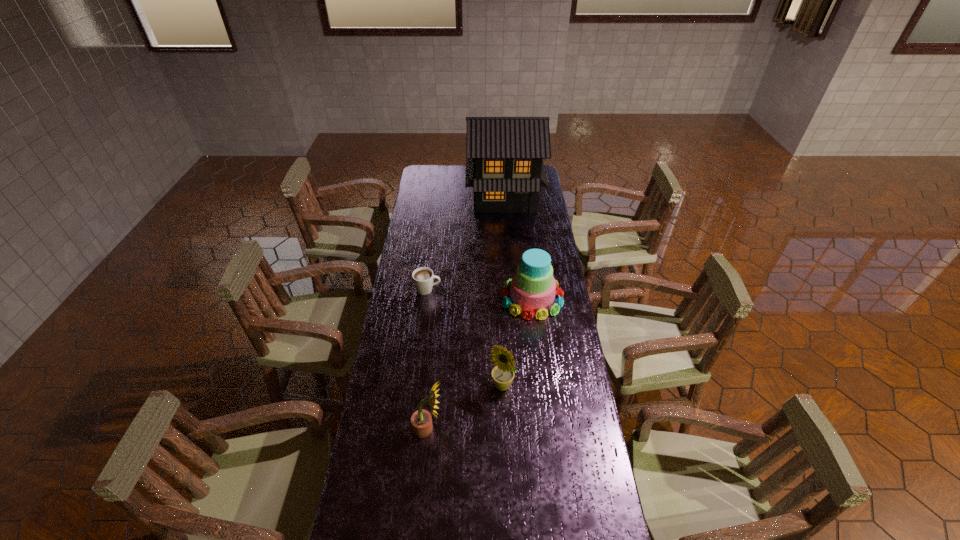
The image size is (960, 540). What are the coordinates of `vacant area situated 0.120m on the face of the nearest object` in the screenshot? It's located at (479, 428).

What are the coordinates of `blank space located on the face of the right sunflower` in the screenshot? It's located at (507, 519).

Locate an element on the screen. free region located with the handle on the side of the shortest object is located at coordinates (488, 289).

Find the location of a particular element. This screenshot has width=960, height=540. object situated at the far edge is located at coordinates (504, 155).

You are a GUI agent. You are given a task and a screenshot of the screen. Output one action in this format:
    pyautogui.click(x=<x>, y=<y>)
    Task: Click on the sunflower positioned at the left edge
    This screenshot has height=540, width=960.
    Given the screenshot: What is the action you would take?
    pyautogui.click(x=421, y=420)

Find the location of a particular element. The height and width of the screenshot is (540, 960). cappuccino located at the left edge is located at coordinates (423, 277).

In order to click on dollhouse present at the right edge in this screenshot , I will do `click(504, 155)`.

Find the location of a particular element. cake at the right edge is located at coordinates (532, 288).

Image resolution: width=960 pixels, height=540 pixels. I want to click on object present at the far right corner, so click(x=504, y=155).

Find the location of `vacant area at the far edge of the desktop`. vacant area at the far edge of the desktop is located at coordinates (458, 181).